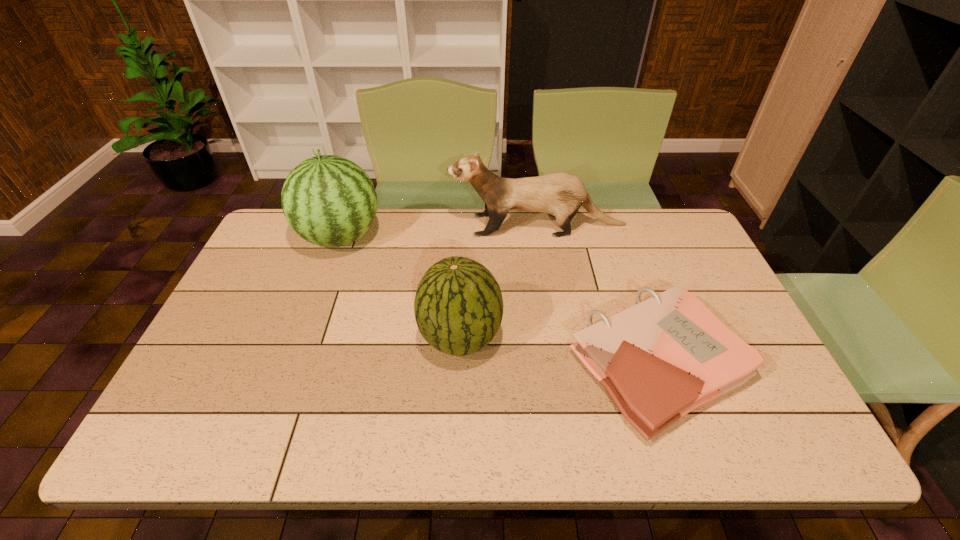
Identify the location of free space located 0.200m on the left of the nearer watermelon. (344, 338).

Image resolution: width=960 pixels, height=540 pixels. What are the coordinates of `free point located on the back of the phonebook` in the screenshot? It's located at (632, 288).

At what (x,y) coordinates should I click in order to perform the action: click on watermelon positioned at the far edge. Please return your answer as a coordinate pair (x, y). The width and height of the screenshot is (960, 540). Looking at the image, I should click on (328, 200).

Find the location of a particular element. The width and height of the screenshot is (960, 540). ferret that is at the far edge is located at coordinates (561, 194).

In order to click on object that is positioned at the near edge in this screenshot , I will do `click(660, 359)`.

At what (x,y) coordinates should I click in order to perform the action: click on object that is positioned at the left edge. Please return your answer as a coordinate pair (x, y). The height and width of the screenshot is (540, 960). Looking at the image, I should click on (328, 200).

Where is `object present at the right edge`? object present at the right edge is located at coordinates (660, 359).

Identify the location of object situated at the far left corner. This screenshot has width=960, height=540. (328, 200).

Locate an element on the screen. object that is at the near right corner is located at coordinates (660, 359).

Where is `vacant space at the far edge`? The height and width of the screenshot is (540, 960). vacant space at the far edge is located at coordinates (583, 224).